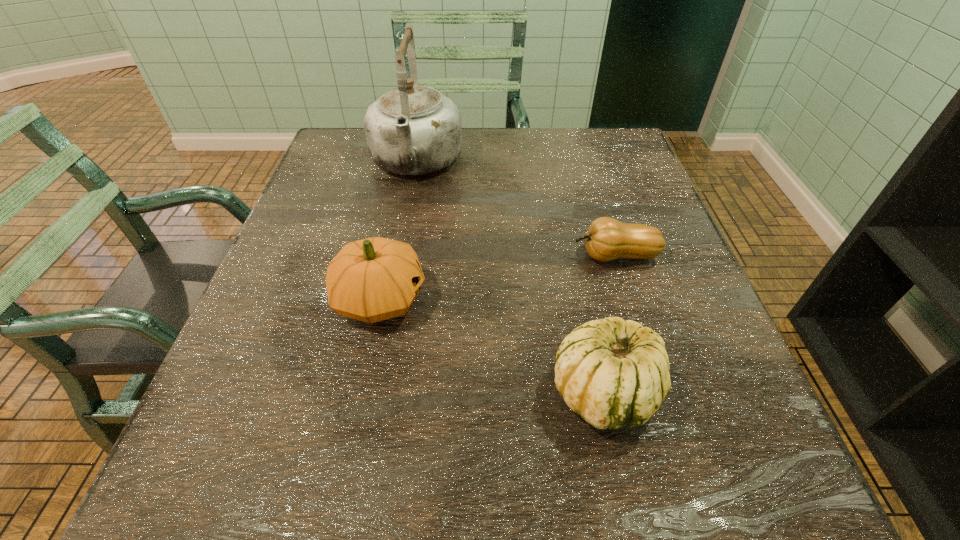
I want to click on vacant space at the near left corner of the desktop, so click(260, 514).

The width and height of the screenshot is (960, 540). Find the location of `vacant space at the far right corner of the desktop`. vacant space at the far right corner of the desktop is located at coordinates (622, 168).

In order to click on free location at the near right corner in this screenshot , I will do `click(698, 482)`.

Find the location of a particular element. free spot between the shortest gourd and the kettle is located at coordinates pos(516,209).

The height and width of the screenshot is (540, 960). In order to click on vacant area that lies between the leftmost gourd and the nearest object in this screenshot , I will do `click(492, 345)`.

Locate an element on the screen. vacant space in between the shortest object and the leftmost gourd is located at coordinates (497, 277).

Where is `vacant region between the shortest object and the farthest object`? The width and height of the screenshot is (960, 540). vacant region between the shortest object and the farthest object is located at coordinates (516, 209).

This screenshot has height=540, width=960. I want to click on free spot between the kettle and the leftmost gourd, so click(398, 231).

Identify which object is the closest to the leftmost gourd. Please provide its 2D coordinates. Your answer should be formatted as a tuple, i.e. [(x, y)], where the tuple contains the x and y coordinates of a point satisfying the conditions above.

[(614, 373)]

Locate an element on the screen. This screenshot has height=540, width=960. the second closest object to the tallest object is located at coordinates (607, 239).